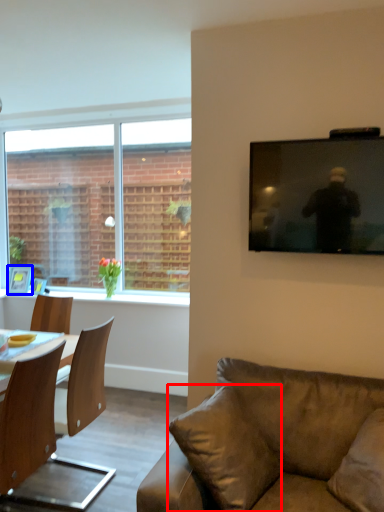
Question: Which object appears closest to the camera in this image, pillow (highlighted by a red box) or picture frame (highlighted by a blue box)?

Choices:
 (A) pillow
 (B) picture frame

Answer: (A)